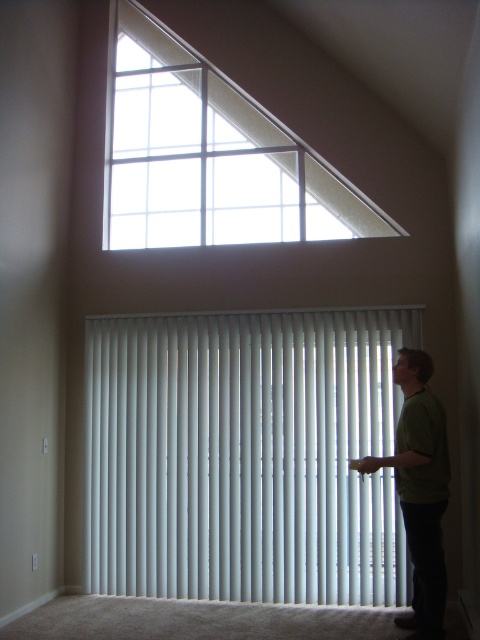
You are standing in the room and want to adjust the lighting. Which object, the white vertical blinds at center or the clear glass window at upper center, is closer to you so you can reach it easily?

The white vertical blinds at center is closer to the viewer than the clear glass window at upper center, so you can reach it easily.